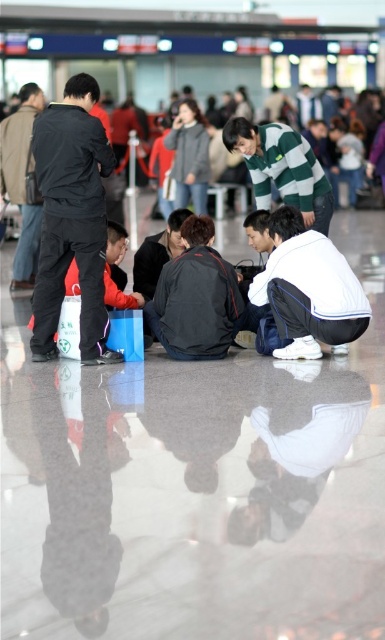
Question: Does dark gray fabric jacket at center appear over dark gray sweater at center?

Choices:
 (A) no
 (B) yes

Answer: (A)

Question: Where is dark gray fabric jacket at center located in relation to dark gray sweater at center in the image?

Choices:
 (A) left
 (B) right

Answer: (B)

Question: Among these objects, which one is nearest to the camera?

Choices:
 (A) dark gray sweater at center
 (B) white matte jacket at center
 (C) black matte jacket at left
 (D) dark gray fabric jacket at center

Answer: (C)

Question: Which of the following is the farthest from the observer?

Choices:
 (A) (227, 125)
 (B) (182, 250)
 (C) (194, 230)

Answer: (B)

Question: Is black matte jacket at left smaller than white matte jacket at center?

Choices:
 (A) no
 (B) yes

Answer: (A)

Question: Which point is farther to the camera?

Choices:
 (A) white matte jacket at center
 (B) dark gray sweater at center

Answer: (B)